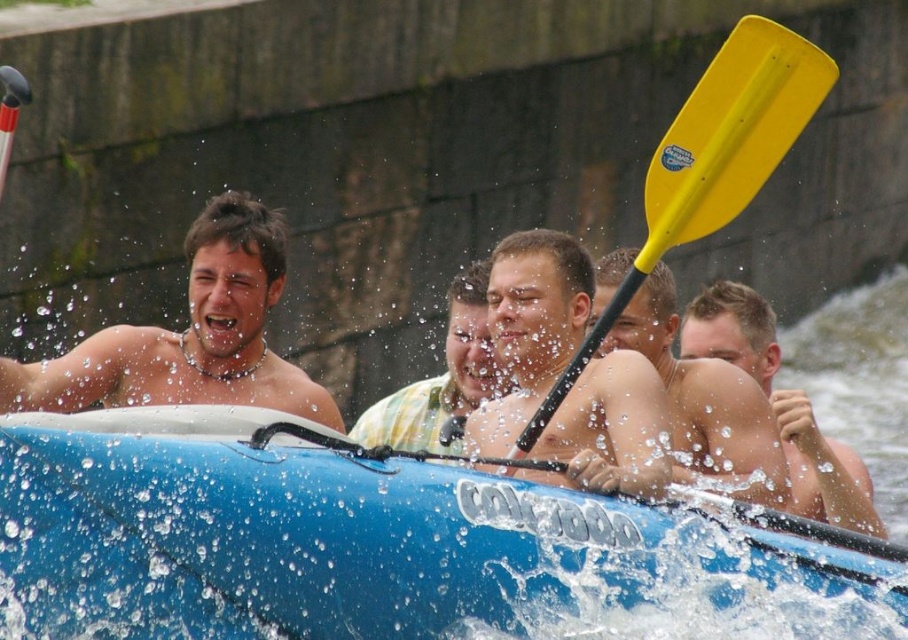
Question: Is smooth skin face at center smaller than yellow plastic paddle at center?

Choices:
 (A) no
 (B) yes

Answer: (B)

Question: Can you confirm if shiny silver necklace at left is bigger than yellow matte paddle at center?

Choices:
 (A) no
 (B) yes

Answer: (B)

Question: Which point is closer to the camera?

Choices:
 (A) 601,298
 (B) 714,116
 (C) 474,364

Answer: (B)

Question: Does smooth skin face at center lie behind yellow matte paddle at center?

Choices:
 (A) yes
 (B) no

Answer: (B)

Question: Among these points, which one is farthest from the camera?

Choices:
 (A) (244, 339)
 (B) (336, 595)

Answer: (A)

Question: Which point is closer to the camera taking this photo?

Choices:
 (A) (386, 408)
 (B) (786, 435)

Answer: (B)